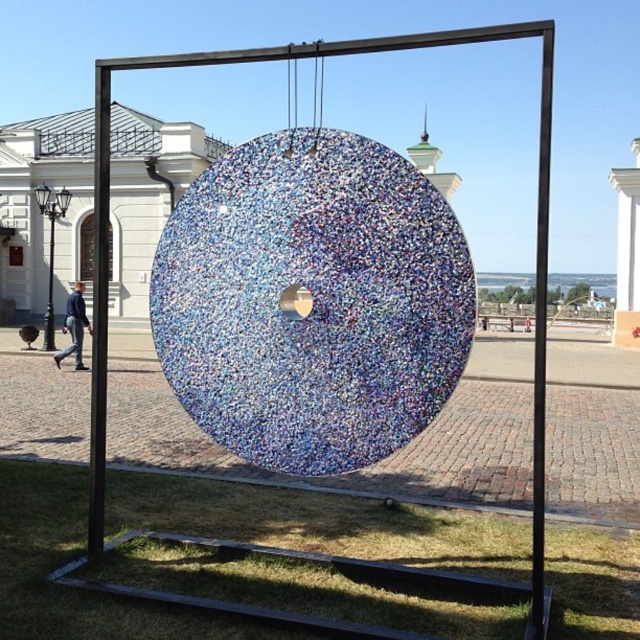
You are a visitor standing on the red brick walkway near the translucent mosaic circle at center and the blue denim jacket at lower left. Which object is positioned higher relative to the ground?

The translucent mosaic circle at center is above the blue denim jacket at lower left, so it is positioned higher relative to the ground.

You are standing at the center of the square and want to find the translucent mosaic circle at center. Based on the coordinates provided, in which direction should you walk to reach it?

The translucent mosaic circle at center is located at coordinates approximately 0.472 on the x and 0.489 on the y axis. Since you are at the center of the square, which is the origin point, you should walk northeast to reach it.

You are standing in the plaza and want to pick up the blue denim jacket at lower left. To reach it, you must walk past the translucent mosaic circle at center. Is the path clear between them?

The translucent mosaic circle at center is closer to the viewer than blue denim jacket at lower left, so you must walk past the translucent mosaic circle at center to reach the blue denim jacket at lower left. The path is clear as there is no obstruction mentioned between them.